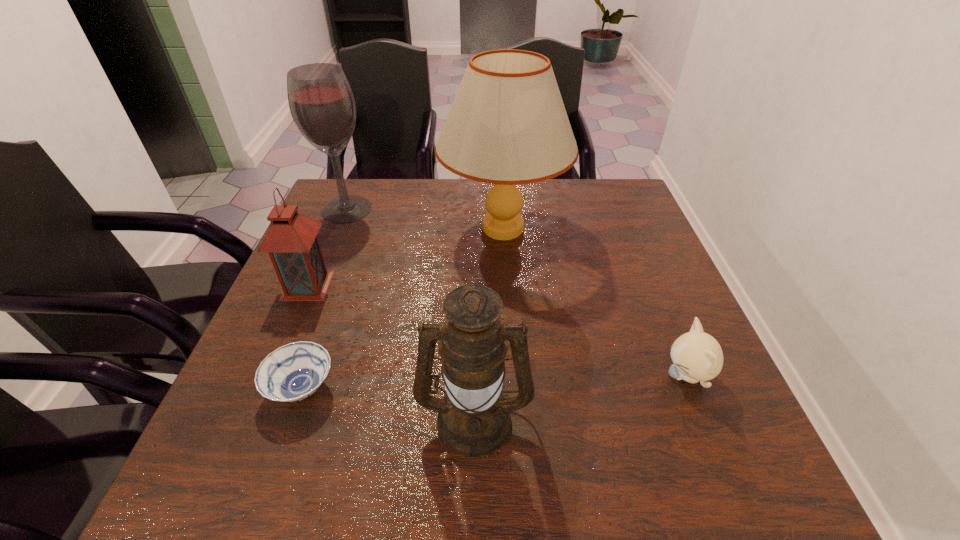
In order to click on vacant area that lies between the shortest object and the oil lamp in this screenshot , I will do `click(388, 403)`.

Where is `empty space between the lampshade and the alcohol`? This screenshot has width=960, height=540. empty space between the lampshade and the alcohol is located at coordinates (425, 219).

The height and width of the screenshot is (540, 960). Identify the location of unoccupied area between the rightmost object and the alcohol. (516, 292).

Find the location of a particular element. The height and width of the screenshot is (540, 960). free point between the lampshade and the fourth nearest object is located at coordinates (405, 257).

The width and height of the screenshot is (960, 540). What are the coordinates of `vacant space in between the second shortest object and the alcohol` in the screenshot? It's located at (516, 292).

The image size is (960, 540). I want to click on vacant space that's between the soup bowl and the lampshade, so click(402, 308).

Find the location of a particular element. The height and width of the screenshot is (540, 960). free area in between the lampshade and the alcohol is located at coordinates (425, 219).

In order to click on object that is the closest to the kitten in this screenshot , I will do [x=474, y=420].

Choose which object is the fifth nearest neighbor to the soup bowl. Please provide its 2D coordinates. Your answer should be formatted as a tuple, i.e. [(x, y)], where the tuple contains the x and y coordinates of a point satisfying the conditions above.

[(697, 356)]

You are a GUI agent. You are given a task and a screenshot of the screen. Output one action in this format:
    pyautogui.click(x=<x>, y=<y>)
    Task: Click on the vacant space that satisfies the following two spatial constraints: 1. on the front side of the shortest object; 2. on the right side of the alcohol
    
    Given the screenshot: What is the action you would take?
    pyautogui.click(x=275, y=388)